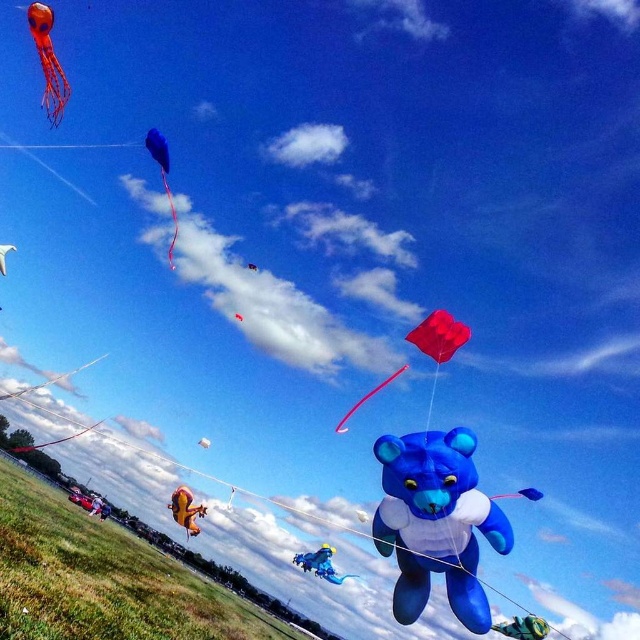
You are a photographer trying to capture the shiny red kite at center in the center of your photo. Based on its current position, is it already centered in the frame?

The shiny red kite at center is located at coordinates point (438, 336), which is slightly off the exact center of the frame. To center it, you would need to adjust the camera slightly upwards and to the right.

You are a spectator at the kite festival and want to take a photo of both the shiny metallic bear at lower right and the white matte kite at center. Which kite should you focus on first if you want to capture both in the same frame without zooming in or out?

You should focus on the shiny metallic bear at lower right first because it is larger in size than the white matte kite at center, so it will take up more space in the frame. By centering the larger kite first, you can adjust the camera angle to include the smaller one without needing to zoom.

You are a spectator at the kite festival looking up at the sky. You notice the yellow fabric kite at lower center and the red matte kite at center. Which kite is positioned lower in the sky?

The yellow fabric kite at lower center is positioned lower in the sky than the red matte kite at center.